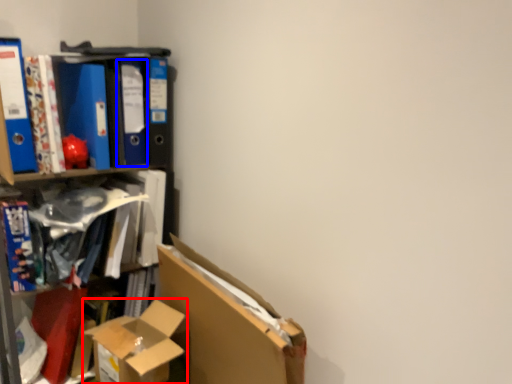
Question: Which point is further to the camera, box (highlighted by a red box) or paperback book (highlighted by a blue box)?

Choices:
 (A) box
 (B) paperback book

Answer: (B)